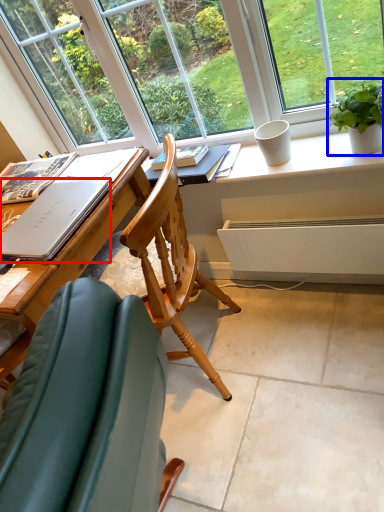
Question: Among these objects, which one is farthest to the camera, laptop (highlighted by a red box) or houseplant (highlighted by a blue box)?

Choices:
 (A) laptop
 (B) houseplant

Answer: (B)